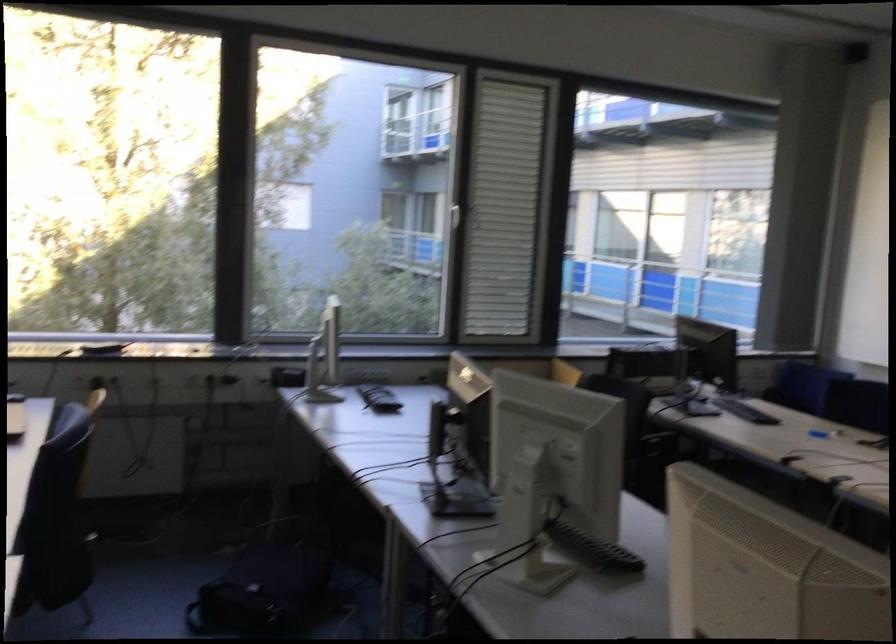
Locate an element on the screen. black backpack is located at coordinates (262, 591).